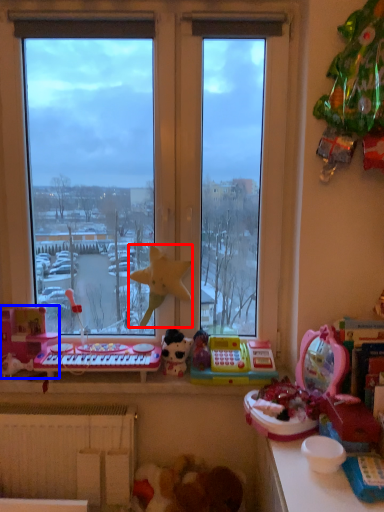
Question: Which point is closer to the camera, toy (highlighted by a red box) or toy (highlighted by a blue box)?

Choices:
 (A) toy
 (B) toy

Answer: (A)